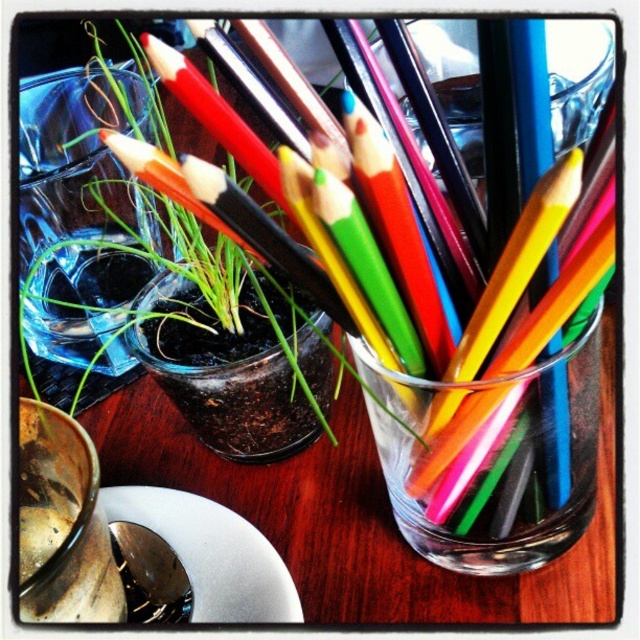
Does point (104, 80) come in front of point (269, 561)?

That is False.

The image size is (640, 640). I want to click on transparent glass vase at upper left, so click(76, 237).

Where is `transparent glass vase at upper left`? transparent glass vase at upper left is located at coordinates (76, 237).